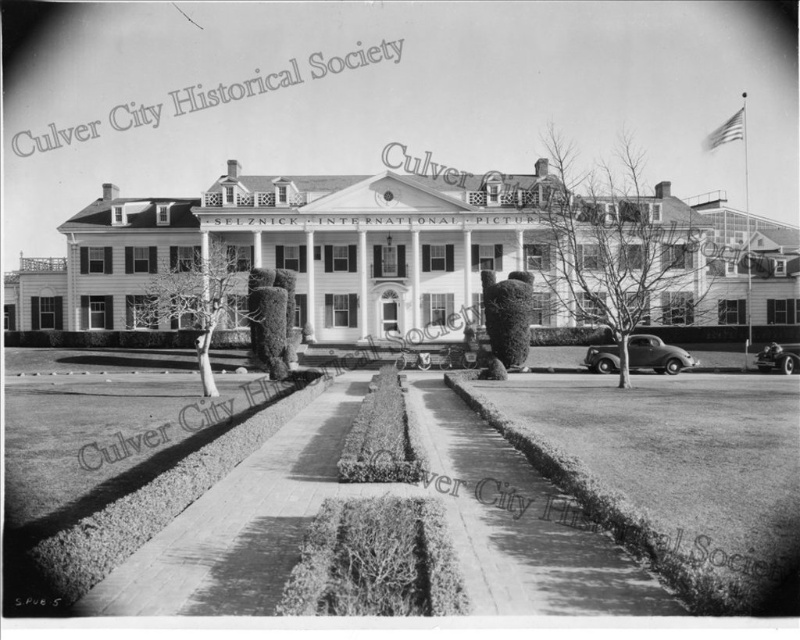
Question: Does shiny silver sedan at center appear on the right side of shiny chrome car at lower right?

Choices:
 (A) no
 (B) yes

Answer: (A)

Question: Is shiny silver sedan at center bigger than shiny chrome car at lower right?

Choices:
 (A) yes
 (B) no

Answer: (A)

Question: Can you confirm if shiny silver sedan at center is positioned to the left of shiny chrome car at lower right?

Choices:
 (A) yes
 (B) no

Answer: (A)

Question: Among these points, which one is nearest to the camera?

Choices:
 (A) (652, 353)
 (B) (786, 344)

Answer: (A)